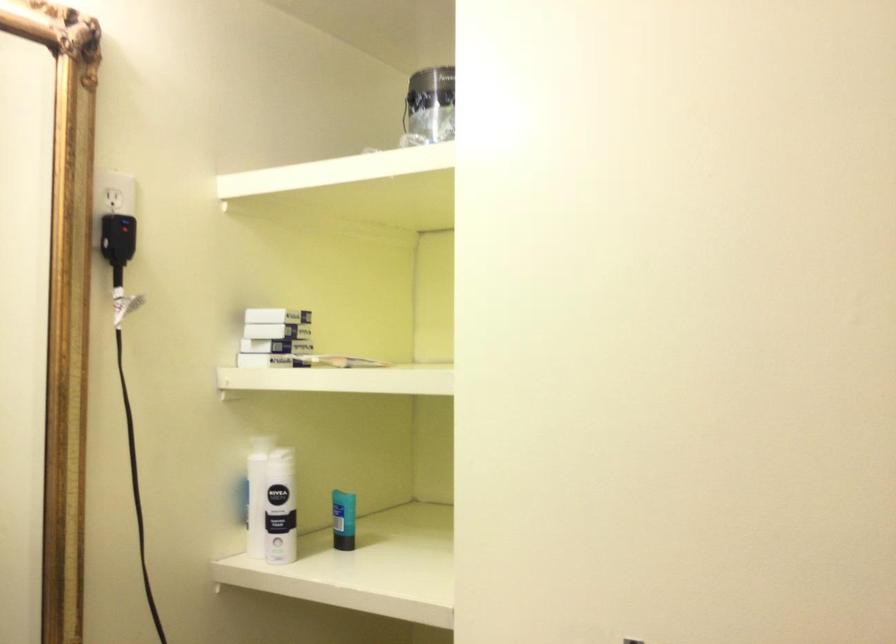
Identify the location of black electrical plug. The height and width of the screenshot is (644, 896). (117, 238).